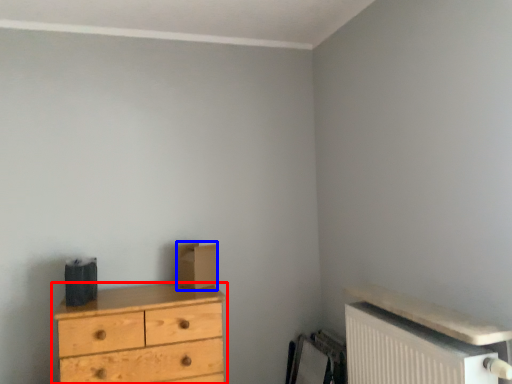
Question: Which object appears farthest to the camera in this image, chest of drawers (highlighted by a red box) or cardboard box (highlighted by a blue box)?

Choices:
 (A) chest of drawers
 (B) cardboard box

Answer: (B)